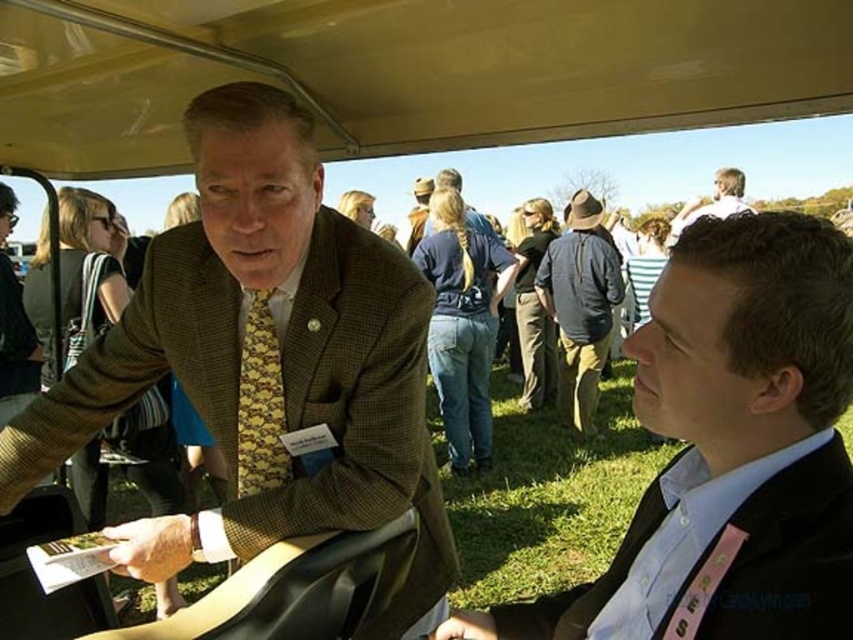
Does black satin business suit at lower right have a lesser width compared to denim jacket at center?

Correct, black satin business suit at lower right's width is less than denim jacket at center's.

Is black satin business suit at lower right bigger than denim jacket at center?

Incorrect, black satin business suit at lower right is not larger than denim jacket at center.

Between point (601, 586) and point (592, 227), which one is positioned behind?

The point (592, 227) is behind.

Where is `black satin business suit at lower right`? black satin business suit at lower right is located at coordinates (785, 556).

Describe the element at coordinates (729, 448) in the screenshot. I see `matte black suit at center` at that location.

From the picture: Can you confirm if matte black suit at center is shorter than yellow patterned tie at center?

No, matte black suit at center is not shorter than yellow patterned tie at center.

Is point (680, 460) closer to viewer compared to point (277, 467)?

Yes, point (680, 460) is in front of point (277, 467).

The height and width of the screenshot is (640, 853). What are the coordinates of `matte black suit at center` in the screenshot? It's located at (729, 448).

Between black satin business suit at lower right and light brown hair at upper right, which one is positioned lower?

black satin business suit at lower right

Who is positioned more to the left, black satin business suit at lower right or light brown hair at upper right?

From the viewer's perspective, black satin business suit at lower right appears more on the left side.

Between point (833, 449) and point (721, 170), which one is positioned in front?

Point (833, 449) is more forward.

Image resolution: width=853 pixels, height=640 pixels. In order to click on black satin business suit at lower right in this screenshot , I will do `click(785, 556)`.